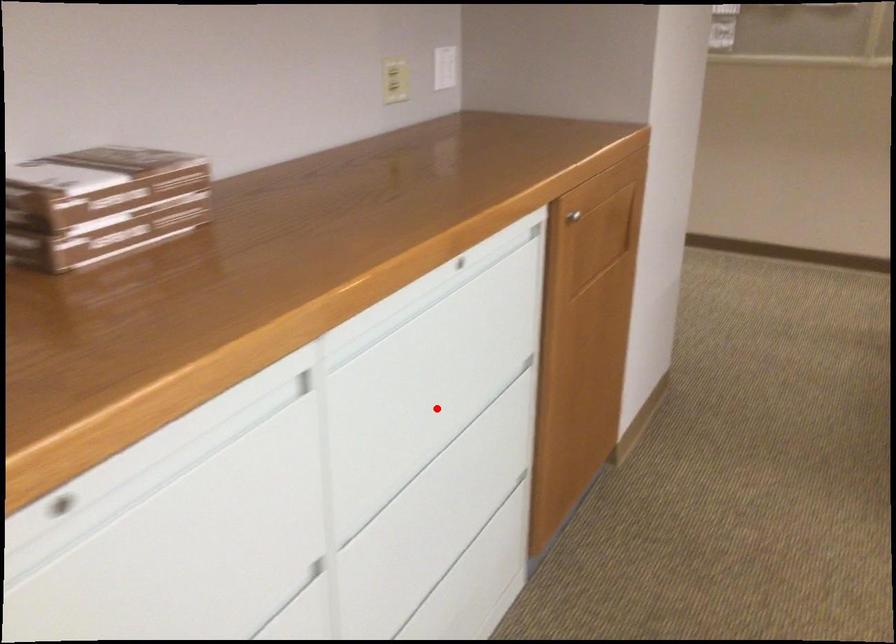
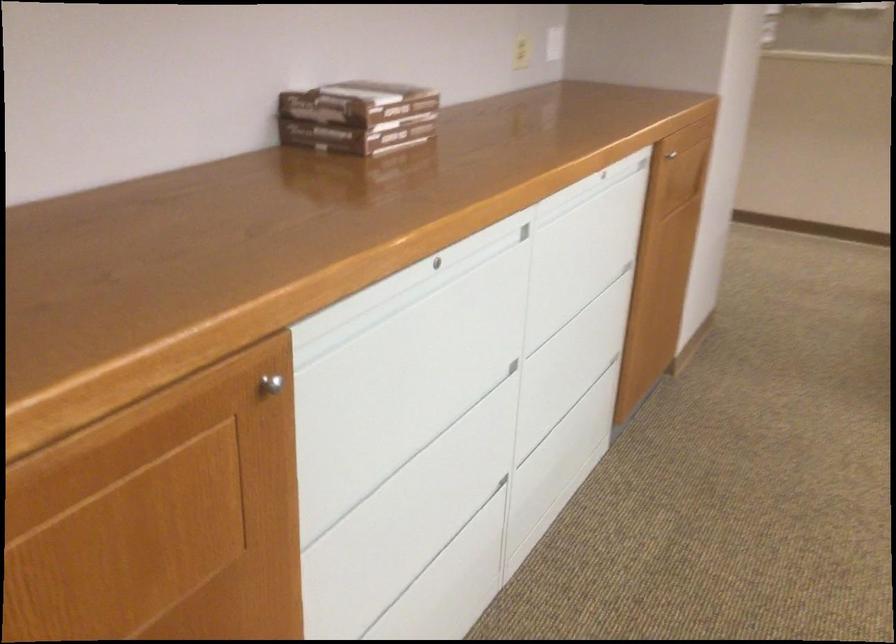
Find the pixel in the second image that matches the highlighted location in the first image.

(579, 279)